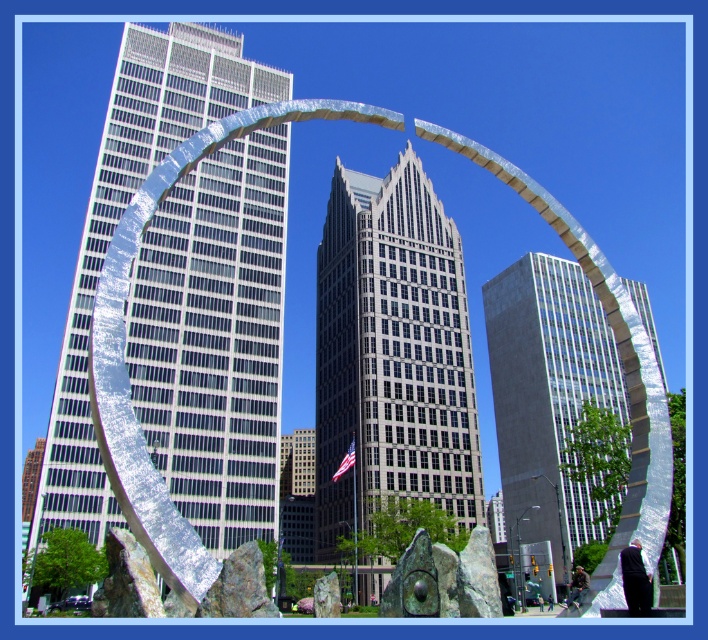
Question: Can you confirm if dark gray glass skyscraper at center is positioned to the right of gray concrete skyscraper at center?

Choices:
 (A) no
 (B) yes

Answer: (A)

Question: From the image, what is the correct spatial relationship of silver metallic sculpture at center in relation to dark gray glass skyscraper at center?

Choices:
 (A) below
 (B) above

Answer: (B)

Question: Which point is farther to the camera?

Choices:
 (A) (343, 216)
 (B) (125, 220)
 (C) (245, 188)

Answer: (A)

Question: Is dark gray glass skyscraper at center to the right of gray concrete skyscraper at center from the viewer's perspective?

Choices:
 (A) no
 (B) yes

Answer: (A)

Question: Which of the following is the farthest from the observer?

Choices:
 (A) dark gray glass skyscraper at center
 (B) shiny metallic arch at center
 (C) silver metallic sculpture at center

Answer: (A)

Question: Among these objects, which one is nearest to the camera?

Choices:
 (A) silver metallic sculpture at center
 (B) gray concrete skyscraper at center

Answer: (A)